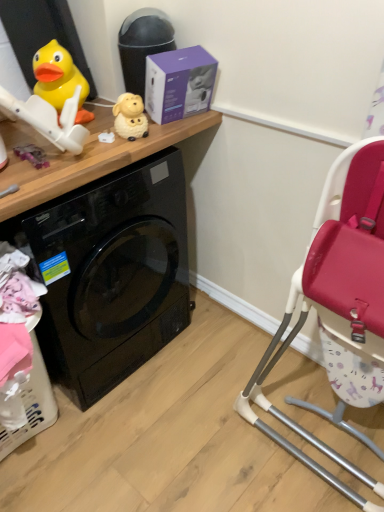
I want to click on free region on the left part of purple fabric toy at left, the 3th toy from the right, so click(x=9, y=155).